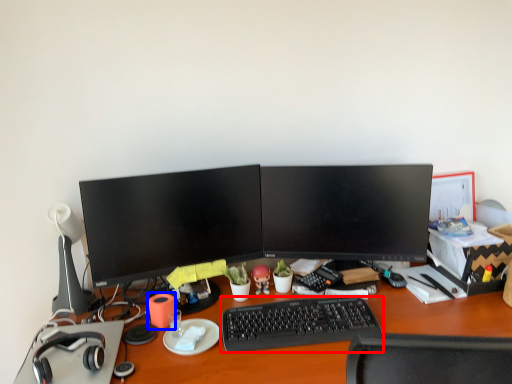
Question: Which object appears farthest to the camera in this image, computer keyboard (highlighted by a red box) or stationery (highlighted by a blue box)?

Choices:
 (A) computer keyboard
 (B) stationery

Answer: (B)